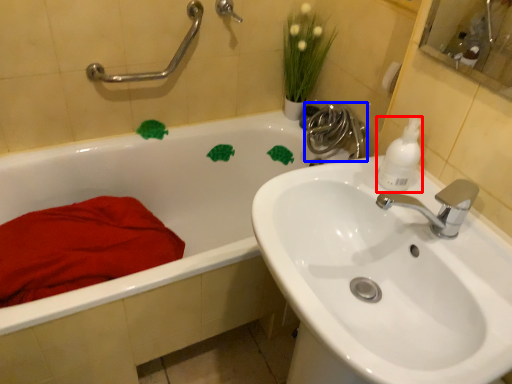
Question: Which point is further to the camera, cleaning product (highlighted by a red box) or plumbing fixture (highlighted by a blue box)?

Choices:
 (A) cleaning product
 (B) plumbing fixture

Answer: (B)